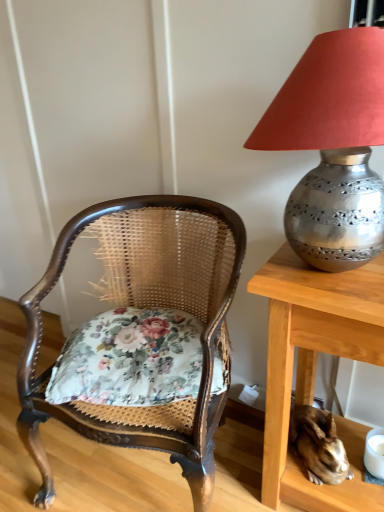
Question: Would you say floral fabric cushion at center is outside shiny metallic rabbit at lower right?

Choices:
 (A) yes
 (B) no

Answer: (A)

Question: Does floral fabric cushion at center have a lesser height compared to shiny metallic rabbit at lower right?

Choices:
 (A) yes
 (B) no

Answer: (A)

Question: Is floral fabric cushion at center looking in the opposite direction of shiny metallic rabbit at lower right?

Choices:
 (A) no
 (B) yes

Answer: (A)

Question: Can you confirm if floral fabric cushion at center is taller than shiny metallic rabbit at lower right?

Choices:
 (A) no
 (B) yes

Answer: (A)

Question: From a real-world perspective, is floral fabric cushion at center physically above shiny metallic rabbit at lower right?

Choices:
 (A) yes
 (B) no

Answer: (A)

Question: Can you confirm if floral fabric cushion at center is positioned to the left of shiny metallic rabbit at lower right?

Choices:
 (A) no
 (B) yes

Answer: (B)

Question: Can you confirm if floral fabric cushion at center is wider than metallic silver lampshade at upper right?

Choices:
 (A) no
 (B) yes

Answer: (B)

Question: Is floral fabric cushion at center further to camera compared to metallic silver lampshade at upper right?

Choices:
 (A) no
 (B) yes

Answer: (B)

Question: Is floral fabric cushion at center facing towards metallic silver lampshade at upper right?

Choices:
 (A) no
 (B) yes

Answer: (A)

Question: Considering the relative positions of floral fabric cushion at center and metallic silver lampshade at upper right in the image provided, is floral fabric cushion at center to the right of metallic silver lampshade at upper right from the viewer's perspective?

Choices:
 (A) yes
 (B) no

Answer: (B)

Question: From a real-world perspective, is floral fabric cushion at center on metallic silver lampshade at upper right?

Choices:
 (A) yes
 (B) no

Answer: (B)

Question: From the image's perspective, is floral fabric cushion at center below metallic silver lampshade at upper right?

Choices:
 (A) yes
 (B) no

Answer: (A)

Question: Is metallic silver lampshade at upper right positioned in front of shiny metallic rabbit at lower right?

Choices:
 (A) no
 (B) yes

Answer: (B)